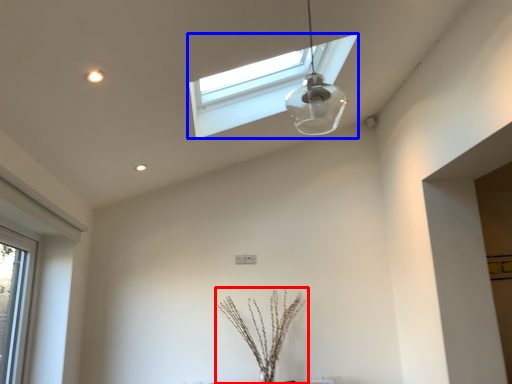
Question: Which object is further to the camera taking this photo, plant (highlighted by a red box) or window (highlighted by a blue box)?

Choices:
 (A) plant
 (B) window

Answer: (A)